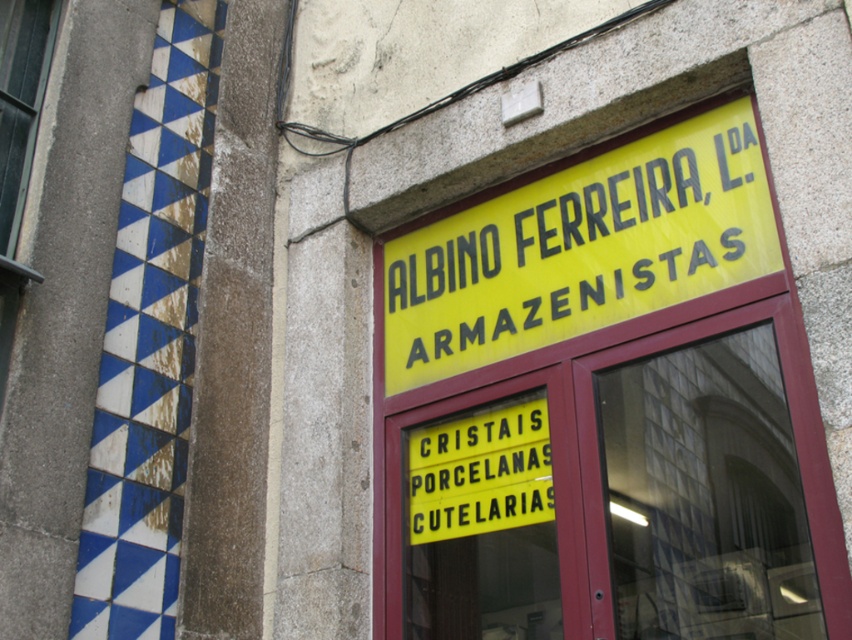
Which is above, yellow plastic sign at upper center or yellow plastic sign at center?

yellow plastic sign at upper center

Who is more distant from viewer, (701, 193) or (527, 492)?

The point (527, 492) is behind.

In order to click on yellow plastic sign at upper center in this screenshot , I will do `click(580, 248)`.

What are the coordinates of `yellow plastic sign at upper center` in the screenshot? It's located at (580, 248).

Is yellow plastic sign at upper center to the left of clear glass window at upper left from the viewer's perspective?

Incorrect, yellow plastic sign at upper center is not on the left side of clear glass window at upper left.

Between point (426, 305) and point (50, 17), which one is positioned behind?

The point (50, 17) is behind.

Between point (509, 307) and point (15, 29), which one is positioned in front?

Point (509, 307) is in front.

You are a GUI agent. You are given a task and a screenshot of the screen. Output one action in this format:
    pyautogui.click(x=<x>, y=<y>)
    Task: Click on the yellow plastic sign at upper center
    The image size is (852, 640).
    Given the screenshot: What is the action you would take?
    pyautogui.click(x=580, y=248)

Does point (516, 458) lie behind point (16, 17)?

No, it is not.

Is yellow plastic sign at center to the right of clear glass window at upper left from the viewer's perspective?

Yes, yellow plastic sign at center is to the right of clear glass window at upper left.

Is point (516, 444) closer to camera compared to point (27, 17)?

That is True.

Image resolution: width=852 pixels, height=640 pixels. What are the coordinates of `yellow plastic sign at center` in the screenshot? It's located at (481, 474).